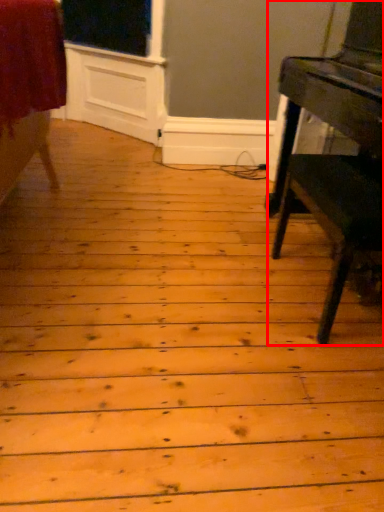
Question: Considering the relative positions of table (annotated by the red box) and furniture in the image provided, where is table (annotated by the red box) located with respect to the staircase?

Choices:
 (A) right
 (B) left

Answer: (A)